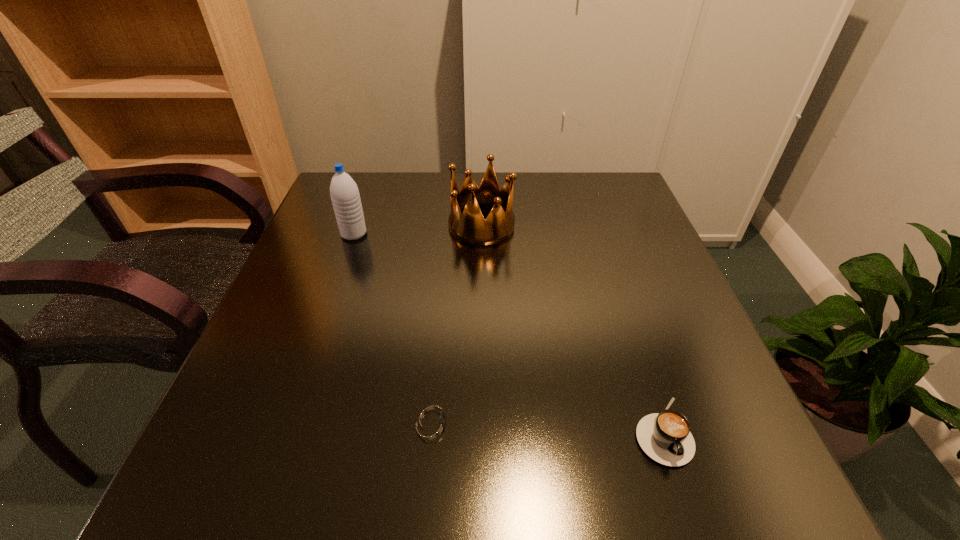
Where is `watch that is at the near edge`? The width and height of the screenshot is (960, 540). watch that is at the near edge is located at coordinates (433, 422).

I want to click on object that is at the left edge, so click(x=344, y=193).

Locate an element on the screen. The width and height of the screenshot is (960, 540). object that is positioned at the right edge is located at coordinates (665, 437).

Find the location of `object situated at the near right corner`. object situated at the near right corner is located at coordinates (665, 437).

The height and width of the screenshot is (540, 960). I want to click on free spot at the far edge of the desktop, so click(399, 174).

Find the location of a particular element. free space at the near edge of the desktop is located at coordinates (640, 484).

In the image, there is a desktop. Where is `vacant space at the left edge`? The width and height of the screenshot is (960, 540). vacant space at the left edge is located at coordinates (223, 402).

The image size is (960, 540). In the image, there is a desktop. Identify the location of vacant space at the right edge. (655, 323).

I want to click on vacant space at the far left corner, so click(369, 218).

Where is `free region at the far right corner`? free region at the far right corner is located at coordinates click(x=616, y=198).